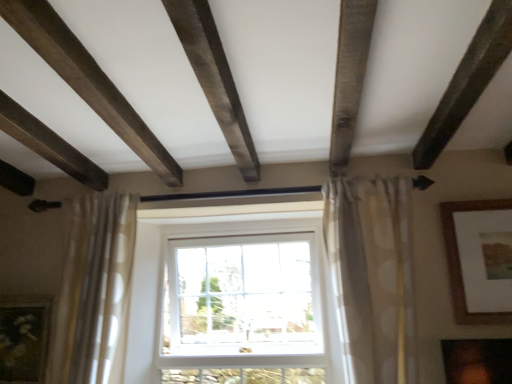
Question: Is the position of matte gold picture frame at lower left, marked as the 1th picture frame in a bottom-to-top arrangement, less distant than that of white plastic window at center?

Choices:
 (A) no
 (B) yes

Answer: (B)

Question: Is matte gold picture frame at lower left, the first picture frame when ordered from left to right, outside of white plastic window at center?

Choices:
 (A) no
 (B) yes

Answer: (B)

Question: Is matte gold picture frame at lower left, placed as the second picture frame when sorted from right to left, to the left of white plastic window at center from the viewer's perspective?

Choices:
 (A) no
 (B) yes

Answer: (B)

Question: From a real-world perspective, does matte gold picture frame at lower left, the 2th picture frame in the top-to-bottom sequence, stand above white plastic window at center?

Choices:
 (A) no
 (B) yes

Answer: (A)

Question: From a real-world perspective, is matte gold picture frame at lower left, the first picture frame when ordered from left to right, positioned under white plastic window at center based on gravity?

Choices:
 (A) no
 (B) yes

Answer: (B)

Question: From the image's perspective, is matte gold picture frame at lower left, the 2th picture frame in the top-to-bottom sequence, below white plastic window at center?

Choices:
 (A) no
 (B) yes

Answer: (B)

Question: Can you confirm if matte gold picture frame at lower left, the 2th picture frame in the top-to-bottom sequence, is positioned to the right of brown wooden picture frame at upper right, the 2th picture frame when ordered from bottom to top?

Choices:
 (A) no
 (B) yes

Answer: (A)

Question: Does matte gold picture frame at lower left, the 2th picture frame in the top-to-bottom sequence, have a greater height compared to brown wooden picture frame at upper right, acting as the 2th picture frame starting from the left?

Choices:
 (A) yes
 (B) no

Answer: (B)

Question: Considering the relative sizes of matte gold picture frame at lower left, the first picture frame when ordered from left to right, and brown wooden picture frame at upper right, positioned as the first picture frame in right-to-left order, in the image provided, is matte gold picture frame at lower left, the first picture frame when ordered from left to right, smaller than brown wooden picture frame at upper right, positioned as the first picture frame in right-to-left order,?

Choices:
 (A) no
 (B) yes

Answer: (A)

Question: From a real-world perspective, is matte gold picture frame at lower left, placed as the second picture frame when sorted from right to left, on brown wooden picture frame at upper right, acting as the 2th picture frame starting from the left?

Choices:
 (A) yes
 (B) no

Answer: (B)

Question: Is matte gold picture frame at lower left, placed as the second picture frame when sorted from right to left, located outside brown wooden picture frame at upper right, the 2th picture frame when ordered from bottom to top?

Choices:
 (A) no
 (B) yes

Answer: (B)

Question: Is matte gold picture frame at lower left, placed as the second picture frame when sorted from right to left, further to camera compared to brown wooden picture frame at upper right, acting as the 2th picture frame starting from the left?

Choices:
 (A) no
 (B) yes

Answer: (B)

Question: From a real-world perspective, is white plastic window at center positioned under matte gold picture frame at lower left, placed as the second picture frame when sorted from right to left, based on gravity?

Choices:
 (A) yes
 (B) no

Answer: (B)